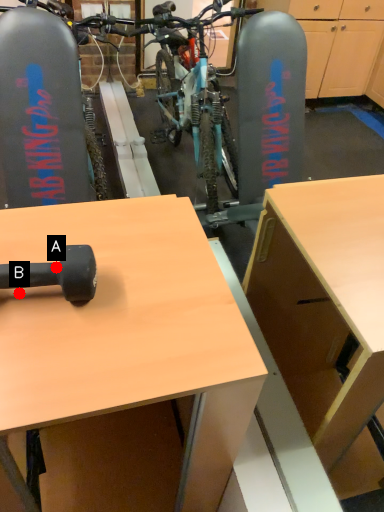
Question: Two points are circled on the image, labeled by A and B beside each circle. Among these points, which one is nearest to the camera?

Choices:
 (A) A is closer
 (B) B is closer

Answer: (A)